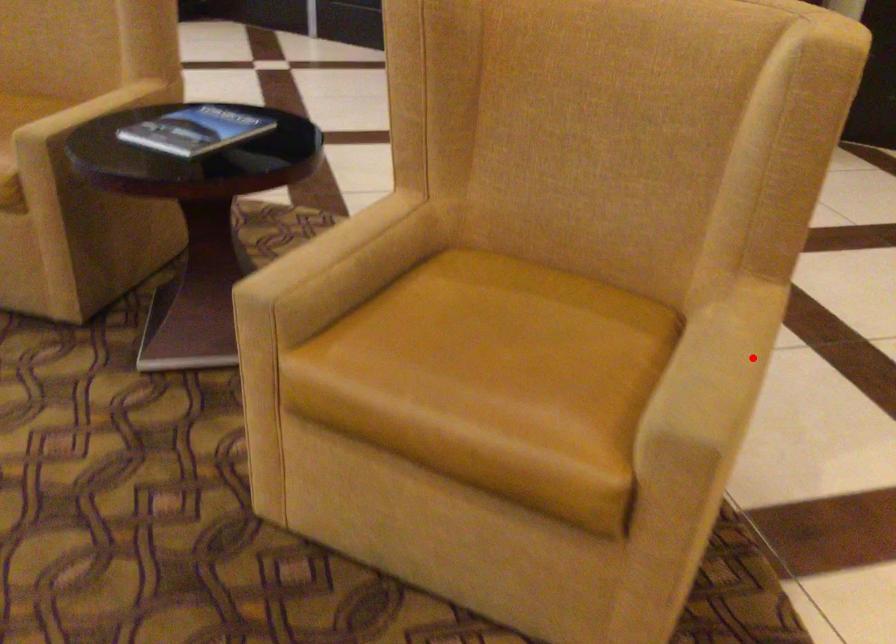
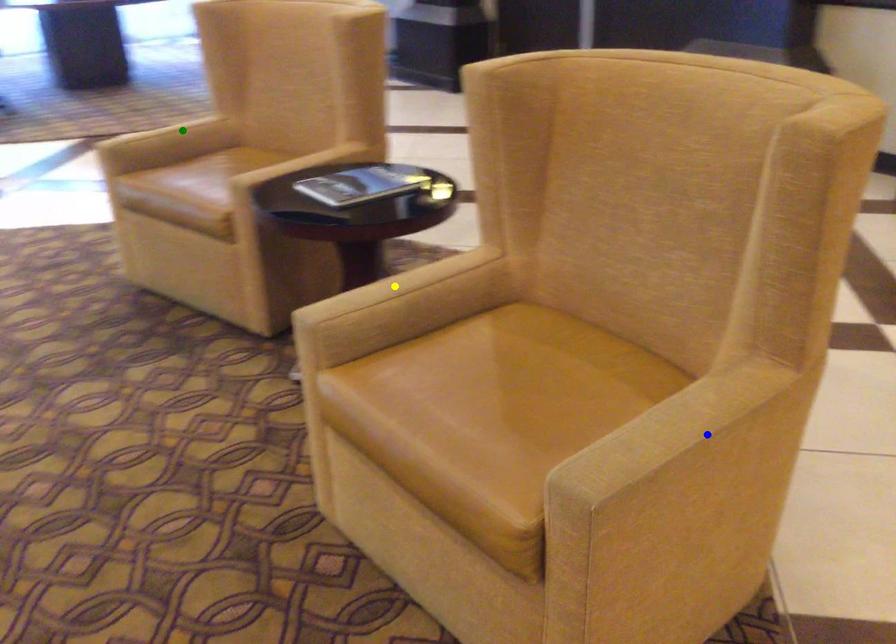
Question: I am providing you with two images of the same scene from different viewpoints. A red point is marked on the first image. You are given multiple points on the second image. Can you choose the point in image 2 that corresponds to the point in image 1?

Choices:
 (A) yellow point
 (B) blue point
 (C) green point

Answer: (B)